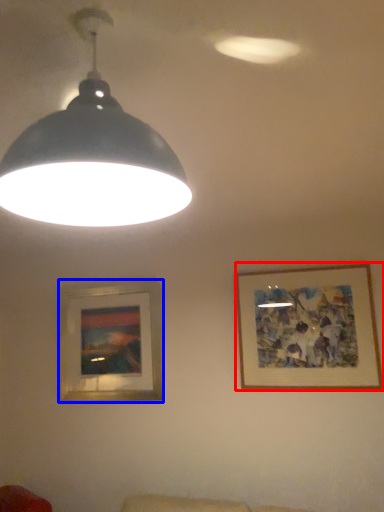
Question: Which of the following is the closest to the observer, picture frame (highlighted by a red box) or picture frame (highlighted by a blue box)?

Choices:
 (A) picture frame
 (B) picture frame

Answer: (A)